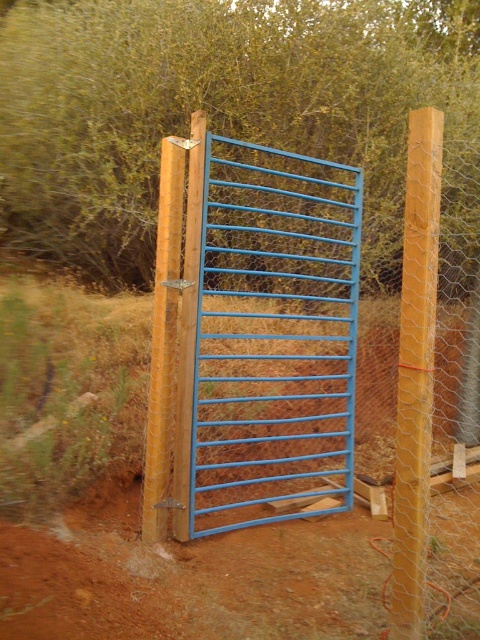
Does dirt field at center have a larger size compared to blue painted metal gate at center?

Indeed, dirt field at center has a larger size compared to blue painted metal gate at center.

Does dirt field at center have a greater height compared to blue painted metal gate at center?

No, dirt field at center is not taller than blue painted metal gate at center.

Is point (213, 605) behind point (226, 266)?

No, (213, 605) is closer to viewer.

The width and height of the screenshot is (480, 640). Identify the location of dirt field at center. (139, 502).